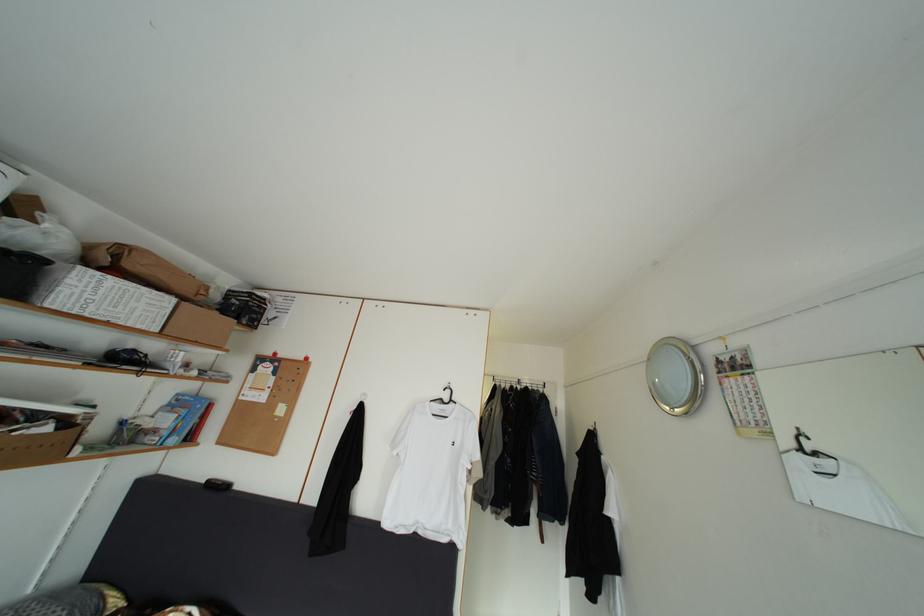
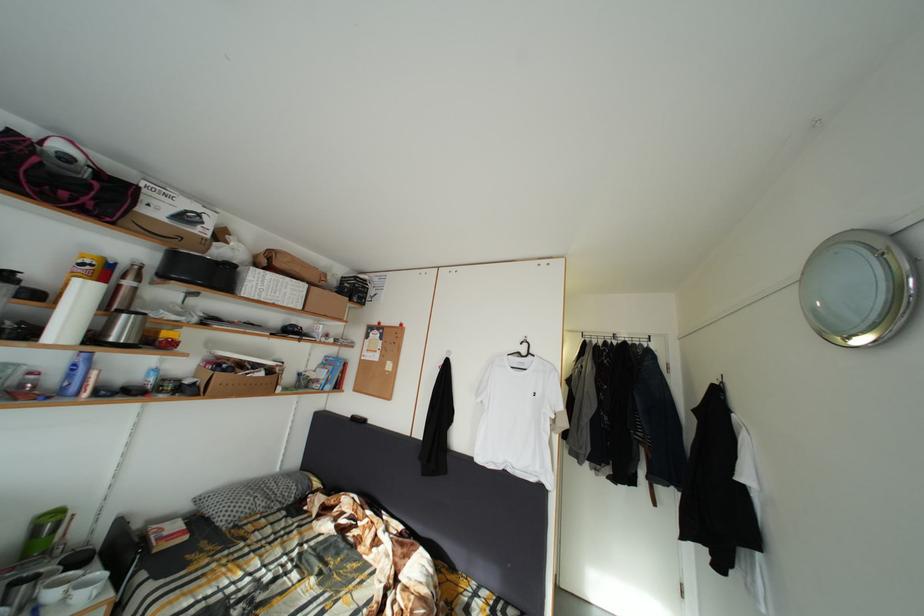
Question: The images are taken continuously from a first-person perspective. In which direction are you moving?

Choices:
 (A) Left
 (B) Right
 (C) Forward
 (D) Backward

Answer: (B)